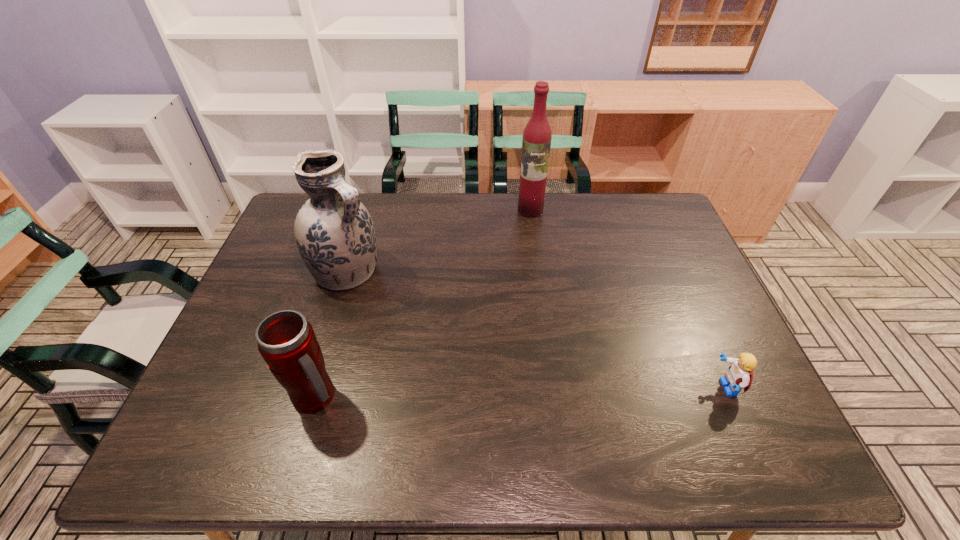
This screenshot has width=960, height=540. Identify the location of free region located on the front-facing side of the Lego. (624, 388).

Locate an element on the screen. The width and height of the screenshot is (960, 540). free region located 0.200m on the label of the liquor is located at coordinates (518, 256).

At what (x,y) coordinates should I click in order to perform the action: click on free space located on the label of the liquor. Please return your answer as a coordinate pair (x, y). Looking at the image, I should click on (521, 246).

At what (x,y) coordinates should I click in order to perform the action: click on free space located 0.150m on the label of the liquor. Please return your answer as a coordinate pair (x, y). Image resolution: width=960 pixels, height=540 pixels. Looking at the image, I should click on (521, 246).

I want to click on vacant space located 0.170m with the handle on the side of the third nearest object, so click(x=417, y=311).

Locate an element on the screen. The image size is (960, 540). vacant region located with the handle on the side of the third nearest object is located at coordinates (447, 330).

Image resolution: width=960 pixels, height=540 pixels. Identify the location of free location located 0.340m with the handle on the side of the third nearest object. (466, 340).

The height and width of the screenshot is (540, 960). In order to click on object that is at the far edge in this screenshot , I will do `click(536, 143)`.

The image size is (960, 540). Find the location of `thermos bottle located at the near edge`. thermos bottle located at the near edge is located at coordinates click(x=286, y=341).

You are a GUI agent. You are given a task and a screenshot of the screen. Output one action in this format:
    pyautogui.click(x=<x>, y=<y>)
    Task: Click on the Lego that is at the near edge
    
    Given the screenshot: What is the action you would take?
    click(x=739, y=375)